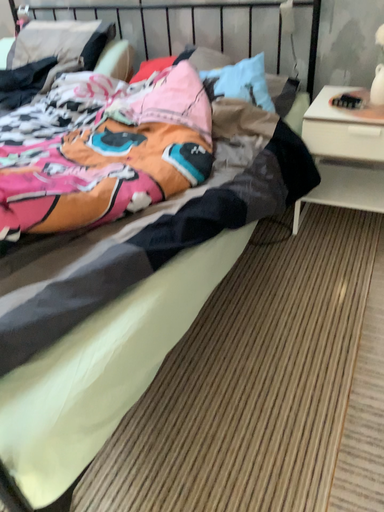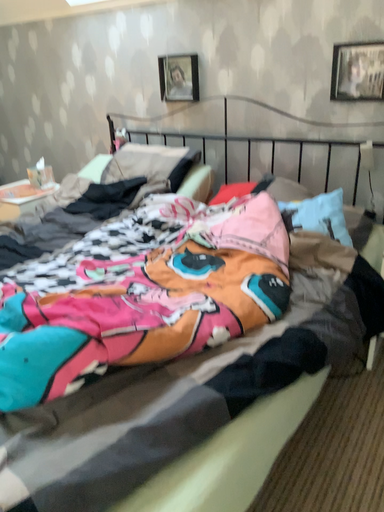
Question: How did the camera likely rotate when shooting the video?

Choices:
 (A) rotated left
 (B) rotated right

Answer: (A)